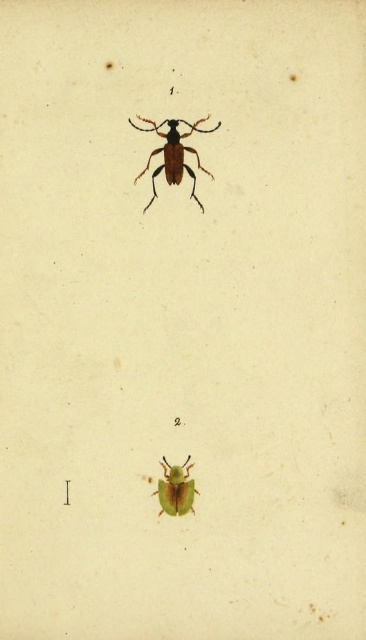
You are an entomologist examining a page from a scientific publication. You notice the matte brown beetle at upper center labeled as Insect 1. Based on its position at point coordinates, can you determine if it is positioned to the left or right of the center of the page?

The matte brown beetle at upper center is positioned at point coordinates, so it is to the left of the center of the page.

You are examining a page from an old scientific journal that displays two beetles. The matte brown beetle at upper center and the green matte beetle at lower center are both present. Based on their positions, which beetle is closer to the viewer?

The matte brown beetle at upper center is closer to the viewer because it is positioned in front of the green matte beetle at lower center.

You are an entomologist examining a page from a scientific publication. You notice two beetles labeled as matte brown beetle at upper center and green matte beetle at lower center. Based on their positions and sizes, which beetle would cast a longer shadow if the light source is directly above them?

The matte brown beetle at upper center is larger in size than the green matte beetle at lower center, so it would cast a longer shadow when illuminated from above.